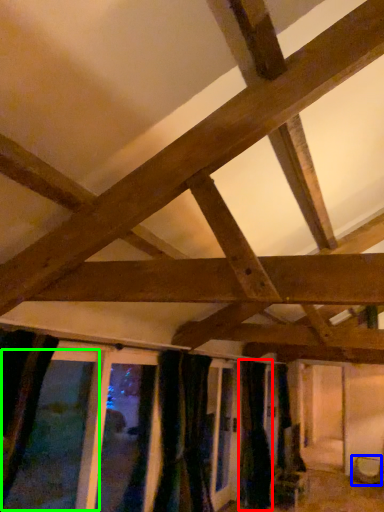
Question: Based on their relative distances, which object is farther from curtain (highlighted by a red box)? Choose from furniture (highlighted by a blue box) and window (highlighted by a green box).

Choices:
 (A) furniture
 (B) window

Answer: (B)